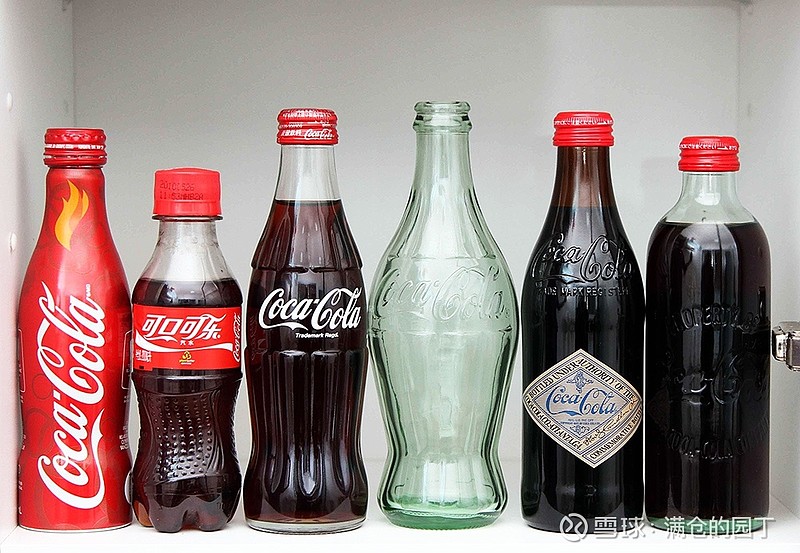
Find the location of a particular element. This screenshot has height=553, width=800. bottles is located at coordinates (61, 356), (201, 324), (318, 321), (448, 318), (604, 300), (725, 321).